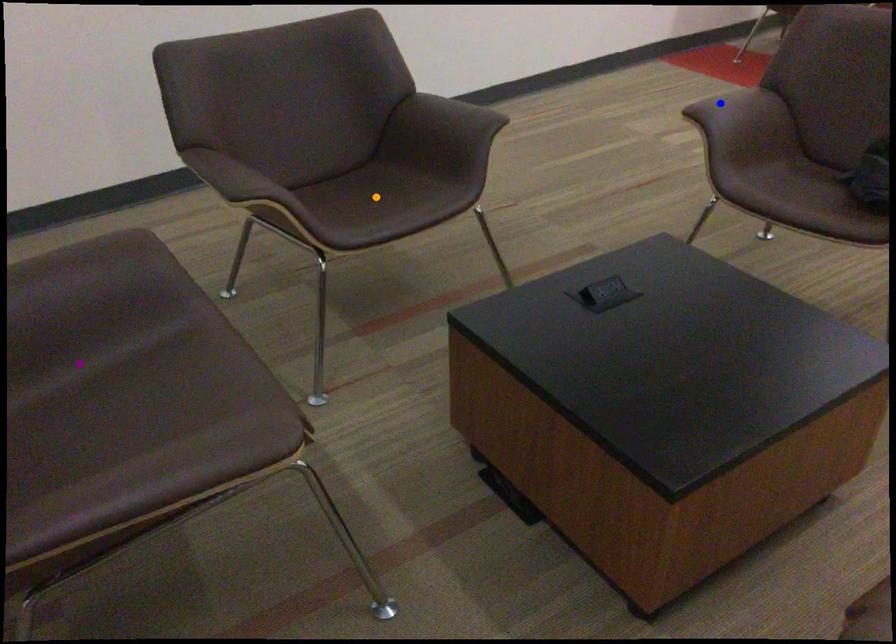
Based on the photo, order these from nearest to farthest:
- blue point
- purple point
- orange point

1. purple point
2. blue point
3. orange point